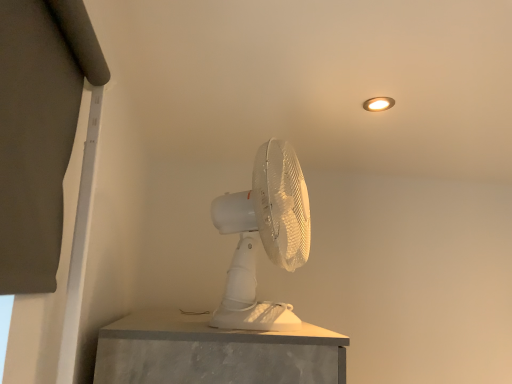
Identify the location of white plastic mechanical fan at center. The width and height of the screenshot is (512, 384). (264, 237).

Measure the distance between point (265, 168) and camera.

They are 38.03 inches apart.

What do you see at coordinates (264, 237) in the screenshot?
I see `white plastic mechanical fan at center` at bounding box center [264, 237].

The width and height of the screenshot is (512, 384). What do you see at coordinates (378, 104) in the screenshot?
I see `matte white light fixture at upper right` at bounding box center [378, 104].

The width and height of the screenshot is (512, 384). What are the coordinates of `matte white light fixture at upper right` in the screenshot? It's located at (378, 104).

Identify the location of white plastic mechanical fan at center. (264, 237).

Considering the relative positions of matte white light fixture at upper right and white plastic mechanical fan at center in the image provided, is matte white light fixture at upper right to the left of white plastic mechanical fan at center from the viewer's perspective?

In fact, matte white light fixture at upper right is to the right of white plastic mechanical fan at center.

Who is more distant, matte white light fixture at upper right or white plastic mechanical fan at center?

Positioned behind is matte white light fixture at upper right.

Does point (385, 103) lie in front of point (234, 264)?

No.

From the image's perspective, is matte white light fixture at upper right under white plastic mechanical fan at center?

No, from the image's perspective, matte white light fixture at upper right is not beneath white plastic mechanical fan at center.

From a real-world perspective, is matte white light fixture at upper right positioned over white plastic mechanical fan at center based on gravity?

Yes, from a real-world perspective, matte white light fixture at upper right is above white plastic mechanical fan at center.

Does matte white light fixture at upper right have a lesser width compared to white plastic mechanical fan at center?

Yes.

From their relative heights in the image, would you say matte white light fixture at upper right is taller or shorter than white plastic mechanical fan at center?

Considering their sizes, matte white light fixture at upper right has less height than white plastic mechanical fan at center.

Does matte white light fixture at upper right have a smaller size compared to white plastic mechanical fan at center?

Correct, matte white light fixture at upper right occupies less space than white plastic mechanical fan at center.

Can white plastic mechanical fan at center be found inside matte white light fixture at upper right?

That's incorrect, white plastic mechanical fan at center is not inside matte white light fixture at upper right.

Is matte white light fixture at upper right far from white plastic mechanical fan at center?

That's not correct — matte white light fixture at upper right is a little close to white plastic mechanical fan at center.

Could you tell me if matte white light fixture at upper right is facing white plastic mechanical fan at center?

No.

How different are the orientations of matte white light fixture at upper right and white plastic mechanical fan at center in degrees?

The facing directions of matte white light fixture at upper right and white plastic mechanical fan at center are 66.6 degrees apart.

The height and width of the screenshot is (384, 512). Find the location of `light fixture positioned vertically above the white plastic mechanical fan at center (from a real-world perspective)`. light fixture positioned vertically above the white plastic mechanical fan at center (from a real-world perspective) is located at coordinates (378, 104).

Between white plastic mechanical fan at center and matte white light fixture at upper right, which one appears on the right side from the viewer's perspective?

From the viewer's perspective, matte white light fixture at upper right appears more on the right side.

Which is behind, white plastic mechanical fan at center or matte white light fixture at upper right?

matte white light fixture at upper right.

Does point (285, 150) come behind point (382, 97)?

No, (285, 150) is in front of (382, 97).

From the image's perspective, would you say white plastic mechanical fan at center is shown under matte white light fixture at upper right?

Yes, from the image's perspective, white plastic mechanical fan at center is beneath matte white light fixture at upper right.

From a real-world perspective, is white plastic mechanical fan at center physically located above or below matte white light fixture at upper right?

Clearly, from a real-world perspective, white plastic mechanical fan at center is below matte white light fixture at upper right.

Which object is wider, white plastic mechanical fan at center or matte white light fixture at upper right?

Wider between the two is white plastic mechanical fan at center.

Is white plastic mechanical fan at center shorter than matte white light fixture at upper right?

Incorrect, the height of white plastic mechanical fan at center does not fall short of that of matte white light fixture at upper right.

Considering the relative sizes of white plastic mechanical fan at center and matte white light fixture at upper right in the image provided, is white plastic mechanical fan at center smaller than matte white light fixture at upper right?

Actually, white plastic mechanical fan at center might be larger than matte white light fixture at upper right.

Is white plastic mechanical fan at center completely or partially outside of matte white light fixture at upper right?

Yes, white plastic mechanical fan at center is located beyond the bounds of matte white light fixture at upper right.

Is white plastic mechanical fan at center with matte white light fixture at upper right?

white plastic mechanical fan at center is not next to matte white light fixture at upper right, and they're not touching.

Could you tell me if white plastic mechanical fan at center is facing matte white light fixture at upper right?

No, white plastic mechanical fan at center is not facing towards matte white light fixture at upper right.

Looking at this image, how many degrees apart are the facing directions of white plastic mechanical fan at center and matte white light fixture at upper right?

66.6 degrees.

You are a GUI agent. You are given a task and a screenshot of the screen. Output one action in this format:
    pyautogui.click(x=<x>, y=<y>)
    Task: Click on the light fixture behind the white plastic mechanical fan at center
    This screenshot has width=512, height=384.
    Given the screenshot: What is the action you would take?
    pyautogui.click(x=378, y=104)

At what (x,y) coordinates should I click in order to perform the action: click on mechanical fan on the left of matte white light fixture at upper right. Please return your answer as a coordinate pair (x, y). Looking at the image, I should click on (264, 237).

Find the location of a particular element. light fixture above the white plastic mechanical fan at center (from the image's perspective) is located at coordinates (378, 104).